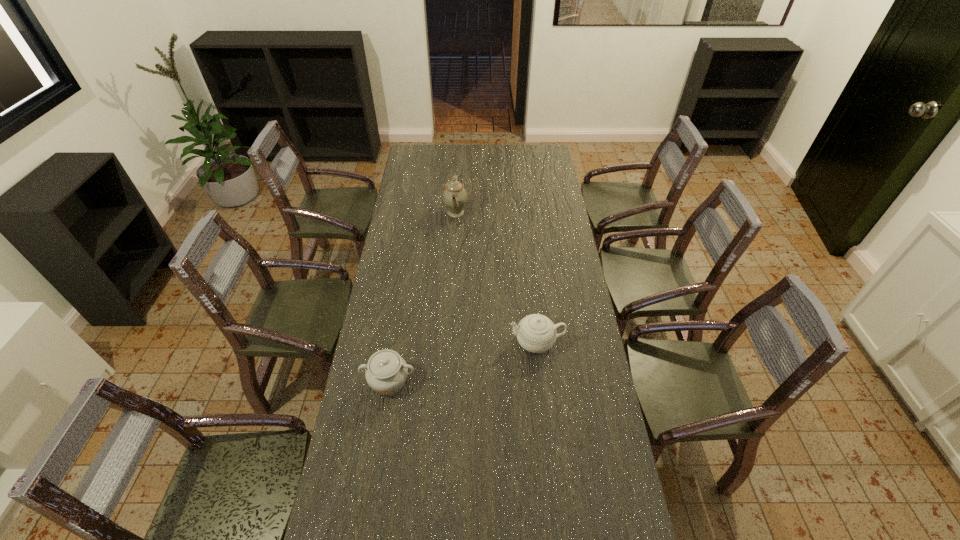
Locate an element on the screen. empty space between the leftmost object and the tallest object is located at coordinates (422, 298).

I want to click on free spot between the nearest object and the second farthest chinaware, so click(463, 362).

The image size is (960, 540). In order to click on free spot between the second nearest chinaware and the farthest object in this screenshot , I will do `click(496, 278)`.

Locate which object is the closest to the nearest chinaware. Please provide its 2D coordinates. Your answer should be formatted as a tuple, i.e. [(x, y)], where the tuple contains the x and y coordinates of a point satisfying the conditions above.

[(536, 333)]

Locate an element on the screen. object that ranks as the second closest to the farthest object is located at coordinates [x=386, y=373].

Image resolution: width=960 pixels, height=540 pixels. Find the location of `the second closest chinaware to the rightmost chinaware`. the second closest chinaware to the rightmost chinaware is located at coordinates pos(454,196).

Point out which chinaware is positioned as the second nearest to the rightmost chinaware. Please provide its 2D coordinates. Your answer should be formatted as a tuple, i.e. [(x, y)], where the tuple contains the x and y coordinates of a point satisfying the conditions above.

[(454, 196)]